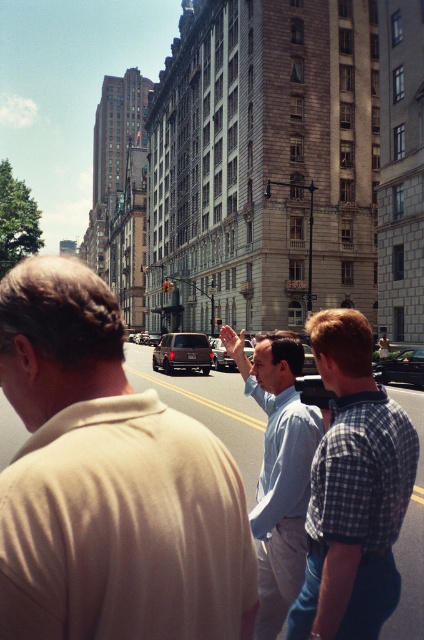
Does light blue shirt at center appear under dark brown leather suv at center?

No, light blue shirt at center is not below dark brown leather suv at center.

Measure the distance from light blue shirt at center to dark brown leather suv at center.

They are 30.37 meters apart.

Image resolution: width=424 pixels, height=640 pixels. What do you see at coordinates (278, 468) in the screenshot?
I see `light blue shirt at center` at bounding box center [278, 468].

You are a GUI agent. You are given a task and a screenshot of the screen. Output one action in this format:
    pyautogui.click(x=<x>, y=<y>)
    Task: Click on the light blue shirt at center
    The image size is (424, 640).
    Given the screenshot: What is the action you would take?
    pyautogui.click(x=278, y=468)

Between shiny black sedan at center and metallic silver car at center, which one is positioned lower?

shiny black sedan at center is below.

Can you confirm if shiny black sedan at center is positioned above metallic silver car at center?

Actually, shiny black sedan at center is below metallic silver car at center.

Locate an element on the screen. shiny black sedan at center is located at coordinates (401, 368).

Does dark brown leather suv at center have a greater height compared to shiny black sedan at center?

Indeed, dark brown leather suv at center has a greater height compared to shiny black sedan at center.

Is dark brown leather suv at center wider than shiny black sedan at center?

Correct, the width of dark brown leather suv at center exceeds that of shiny black sedan at center.

Where is `dark brown leather suv at center`? dark brown leather suv at center is located at coordinates (183, 353).

Image resolution: width=424 pixels, height=640 pixels. I want to click on dark brown leather suv at center, so click(183, 353).